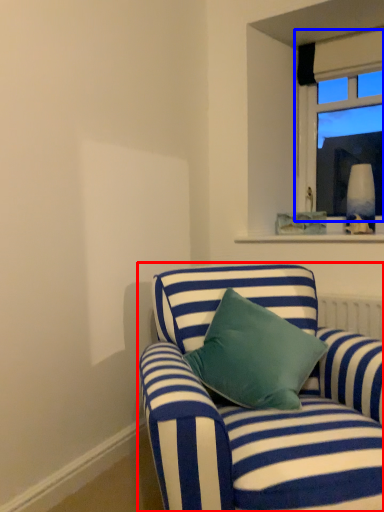
Question: Which point is further to the camera, studio couch (highlighted by a red box) or window (highlighted by a blue box)?

Choices:
 (A) studio couch
 (B) window

Answer: (B)